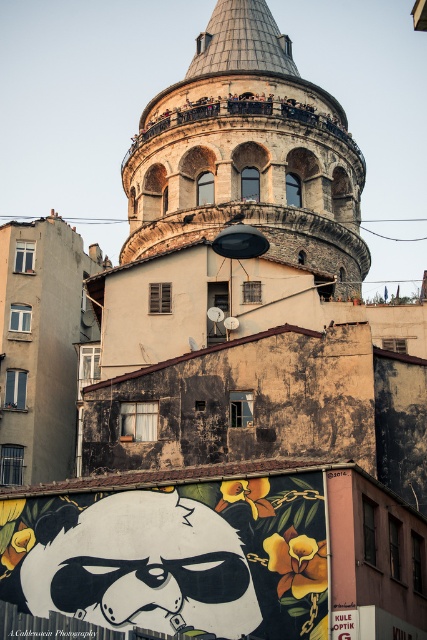
Question: Which point is closer to the camera taking this photo?

Choices:
 (A) (196, 515)
 (B) (274, 84)

Answer: (A)

Question: Is black glossy panda at lower center to the left of stone tower at center from the viewer's perspective?

Choices:
 (A) no
 (B) yes

Answer: (B)

Question: Is black glossy panda at lower center positioned at the back of stone tower at center?

Choices:
 (A) yes
 (B) no

Answer: (B)

Question: Does black glossy panda at lower center lie in front of stone tower at center?

Choices:
 (A) no
 (B) yes

Answer: (B)

Question: Which point appears closest to the camera in this image?

Choices:
 (A) (240, 49)
 (B) (111, 506)

Answer: (B)